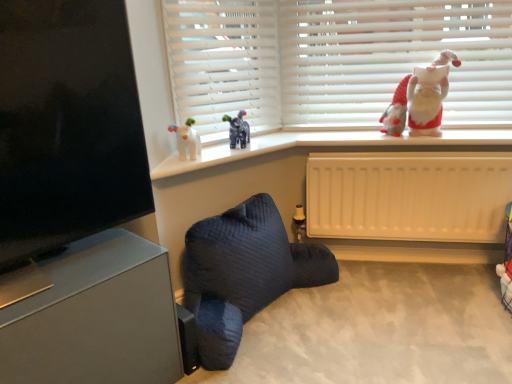
Locate an element on the screen. The image size is (512, 384). vacant space situated on the left part of white ceramic santa at upper right is located at coordinates (360, 135).